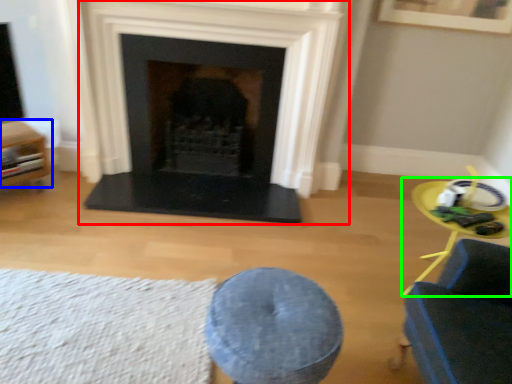
Question: Based on their relative distances, which object is nearer to fireplace (highlighted by a red box)? Choose from furniture (highlighted by a blue box) and round table (highlighted by a green box).

Choices:
 (A) furniture
 (B) round table

Answer: (A)